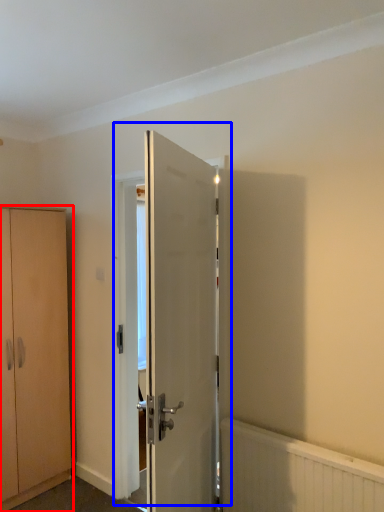
Question: Which of the following is the farthest to the observer, cabinetry (highlighted by a red box) or door (highlighted by a blue box)?

Choices:
 (A) cabinetry
 (B) door

Answer: (A)